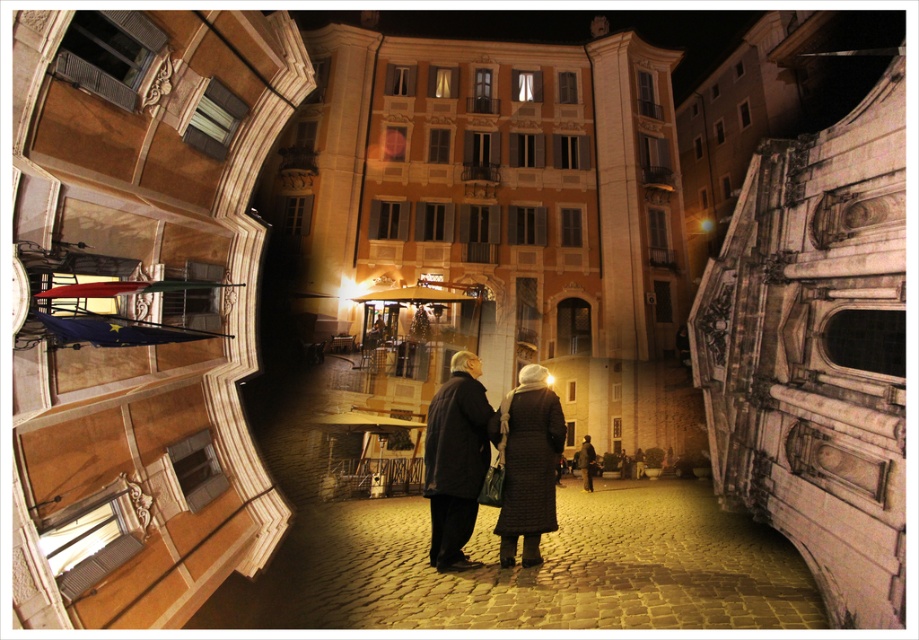
You are a photographer standing in the historic city square. You notice two coats in the scene. The first is a dark wool coat at center, and the second is a quilted black coat at center. Which coat is positioned closer to you?

The dark wool coat at center is closer to the viewer than the quilted black coat at center.

You are a photographer trying to capture the two people walking away in the dark wool coat at center and dark gray coat at center. Which coat is positioned more to the left side of the image?

The dark wool coat at center is positioned more to the left side of the image than the dark gray coat at center.

You are a photographer standing in the historic European city scene. You notice two coats in the center of the image. Which coat is nearer to you, the dark wool coat at center or the dark gray coat at center?

The dark wool coat at center is closer to the viewer than the dark gray coat at center.